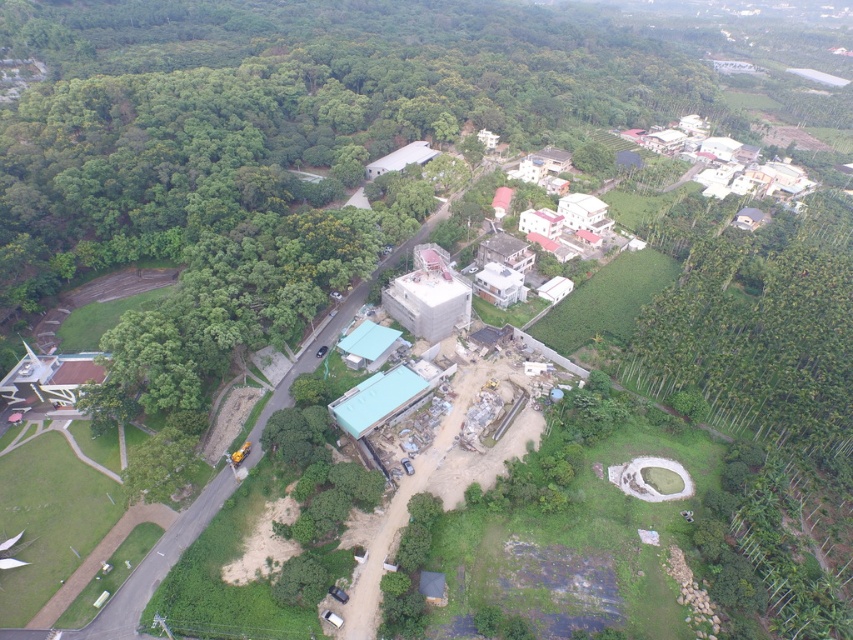
The width and height of the screenshot is (853, 640). Find the location of `green leafy tree at lower left`. green leafy tree at lower left is located at coordinates (276, 109).